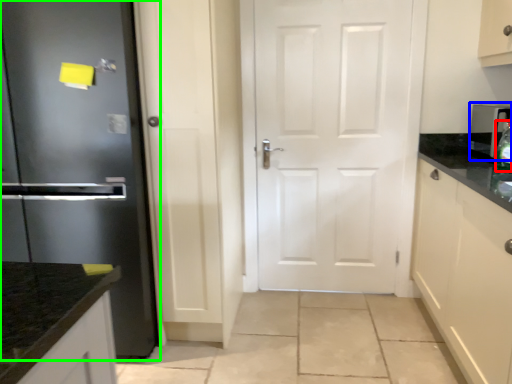
Question: Which object is the farthest from bottle (highlighted by a red box)? Choose among these: appliance (highlighted by a blue box) or refrigerator (highlighted by a green box).

Choices:
 (A) appliance
 (B) refrigerator

Answer: (B)